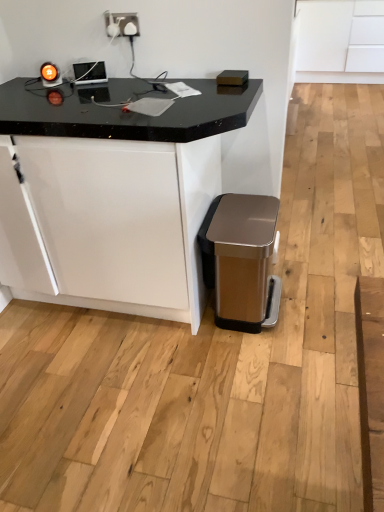
Question: From the image's perspective, is satin gold plastic trash can at lower right located beneath black marble table at center?

Choices:
 (A) no
 (B) yes

Answer: (B)

Question: Is satin gold plastic trash can at lower right shorter than black marble table at center?

Choices:
 (A) no
 (B) yes

Answer: (B)

Question: Does satin gold plastic trash can at lower right appear on the right side of black marble table at center?

Choices:
 (A) no
 (B) yes

Answer: (B)

Question: Can you confirm if satin gold plastic trash can at lower right is wider than black marble table at center?

Choices:
 (A) yes
 (B) no

Answer: (B)

Question: Is satin gold plastic trash can at lower right positioned beyond the bounds of black marble table at center?

Choices:
 (A) yes
 (B) no

Answer: (B)

Question: In the image, is white matte cabinet at upper right positioned in front of or behind satin white socket at upper center?

Choices:
 (A) behind
 (B) front

Answer: (A)

Question: In terms of height, does white matte cabinet at upper right look taller or shorter compared to satin white socket at upper center?

Choices:
 (A) short
 (B) tall

Answer: (B)

Question: Based on their sizes in the image, would you say white matte cabinet at upper right is bigger or smaller than satin white socket at upper center?

Choices:
 (A) small
 (B) big

Answer: (B)

Question: From the image's perspective, is white matte cabinet at upper right above or below satin white socket at upper center?

Choices:
 (A) below
 (B) above

Answer: (B)

Question: From a real-world perspective, is satin white socket at upper center positioned above or below black marble table at center?

Choices:
 (A) above
 (B) below

Answer: (A)

Question: From the image's perspective, is satin white socket at upper center above or below black marble table at center?

Choices:
 (A) above
 (B) below

Answer: (A)

Question: Is point (104, 24) positioned closer to the camera than point (208, 203)?

Choices:
 (A) farther
 (B) closer

Answer: (A)

Question: Is satin white socket at upper center wider or thinner than black marble table at center?

Choices:
 (A) thin
 (B) wide

Answer: (A)

Question: From the image's perspective, relative to satin white socket at upper center, is satin gold plastic trash can at lower right above or below?

Choices:
 (A) below
 (B) above

Answer: (A)

Question: From a real-world perspective, is satin gold plastic trash can at lower right above or below satin white socket at upper center?

Choices:
 (A) above
 (B) below

Answer: (B)